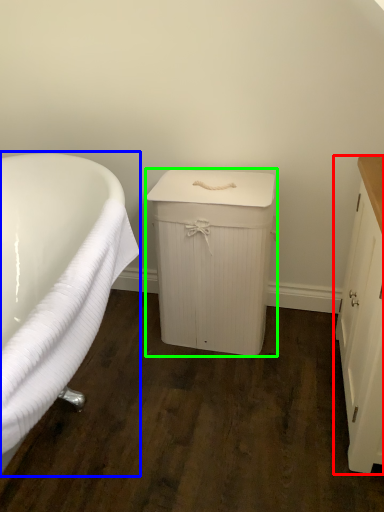
Question: Which object is positioned farthest from cabinetry (highlighted by a red box)? Select from bathtub (highlighted by a blue box) and cabinetry (highlighted by a green box).

Choices:
 (A) bathtub
 (B) cabinetry

Answer: (A)